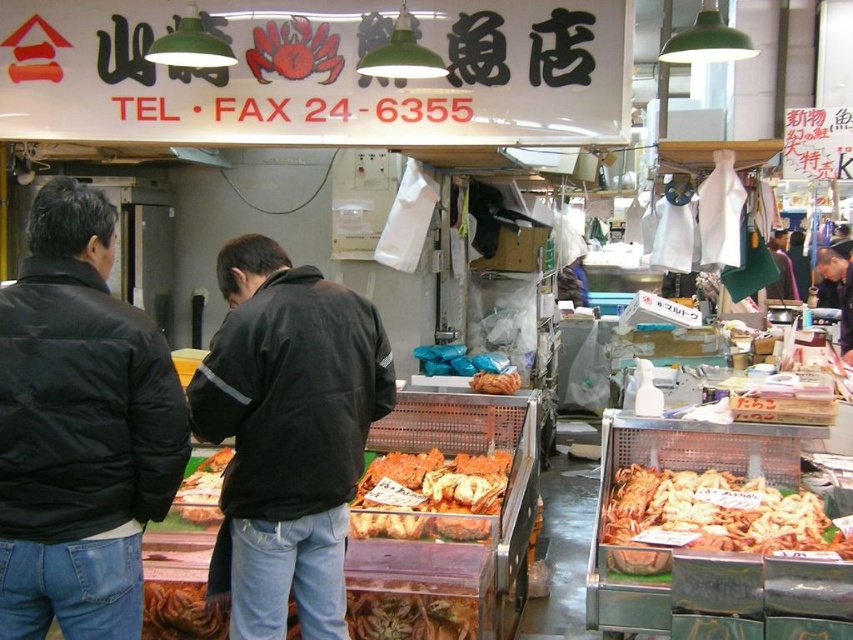
You are a customer at the seafood market stall and want to pick up both the dark gray jacket at center and the brown crispy bread at center. Which item should you reach for first to grab the one closer to you?

The dark gray jacket at center is closer to you, so you should reach for it first before the brown crispy bread at center.

Based on the photo, you are a customer at the seafood market stall. You see two items at the center of the stall, the shiny golden prawns at center and the brown crispy bread at center. Which item takes up more space in the center?

The shiny golden prawns at center is bigger than the brown crispy bread at center, so the shiny golden prawns at center takes up more space in the center.

You are a customer at the seafood market and want to place an order. You have a black leather jacket at center and a shiny plastic tray at center in front of you. Which item can you use to carry more seafood items?

The black leather jacket at center is larger in size than the shiny plastic tray at center, so it can carry more seafood items.